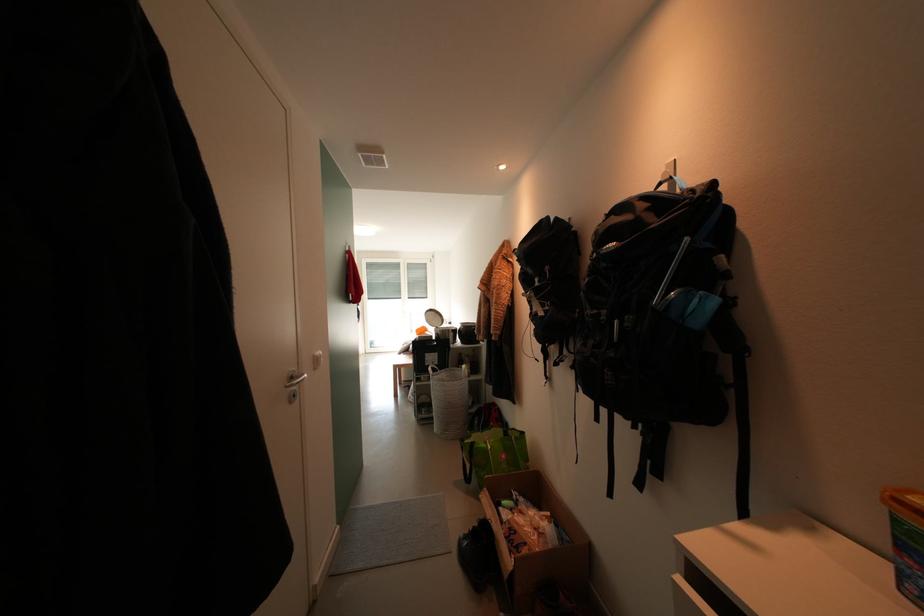
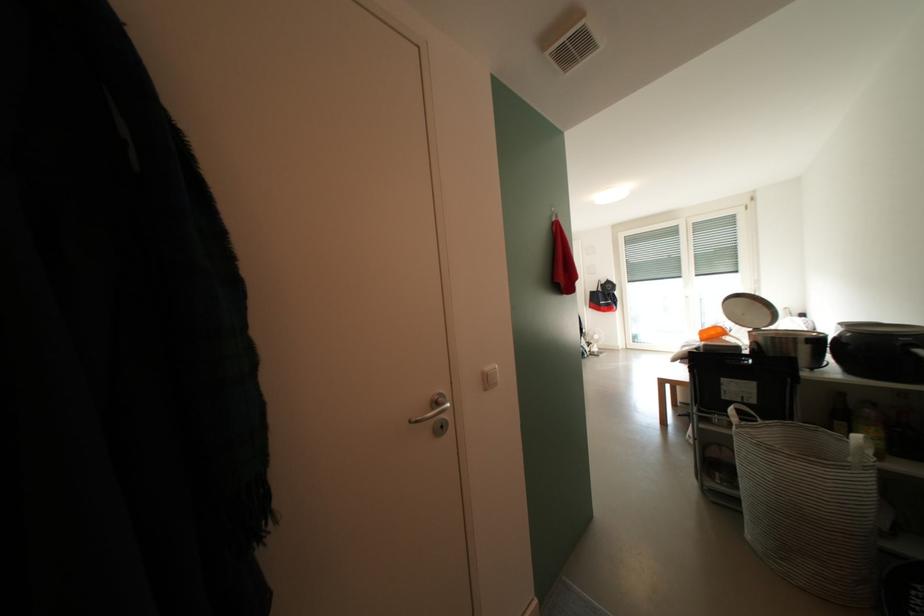
Locate, in the second image, the point that corresponds to (x=424, y=334) in the first image.

(710, 336)